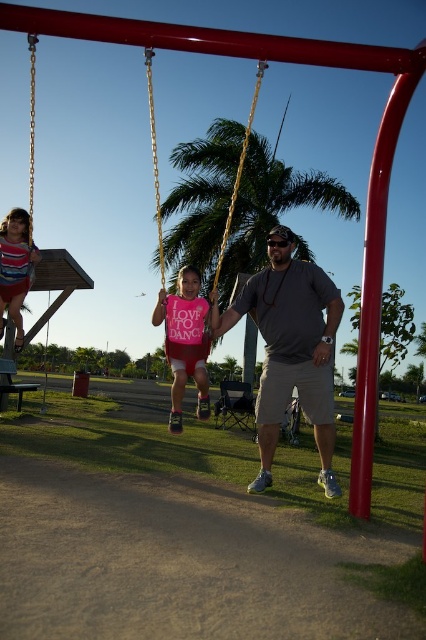
Does pink matte shirt at center have a larger size compared to striped fabric dress at left?

No, pink matte shirt at center is not bigger than striped fabric dress at left.

Is point (199, 362) farther from viewer compared to point (5, 220)?

That is False.

Between point (167, 320) and point (13, 268), which one is positioned in front?

Point (167, 320) is in front.

Where is `pink matte shirt at center`? pink matte shirt at center is located at coordinates (186, 340).

Does green leafy palm tree at center have a greater width compared to striped fabric dress at left?

Yes.

Between green leafy palm tree at center and striped fabric dress at left, which one is positioned lower?

striped fabric dress at left is lower down.

Does point (229, 150) lie in front of point (23, 291)?

No, (229, 150) is behind (23, 291).

The width and height of the screenshot is (426, 640). What are the coordinates of `green leafy palm tree at center` in the screenshot? It's located at (273, 208).

Does gray cotton shirt at center have a lesser width compared to gold chain swing at center?

Yes.

Who is higher up, gray cotton shirt at center or gold chain swing at center?

gold chain swing at center

You are a GUI agent. You are given a task and a screenshot of the screen. Output one action in this format:
    pyautogui.click(x=<x>, y=<y>)
    Task: Click on the gray cotton shirt at center
    
    Given the screenshot: What is the action you would take?
    pyautogui.click(x=290, y=353)

Where is `gray cotton shirt at center`? The height and width of the screenshot is (640, 426). gray cotton shirt at center is located at coordinates (290, 353).